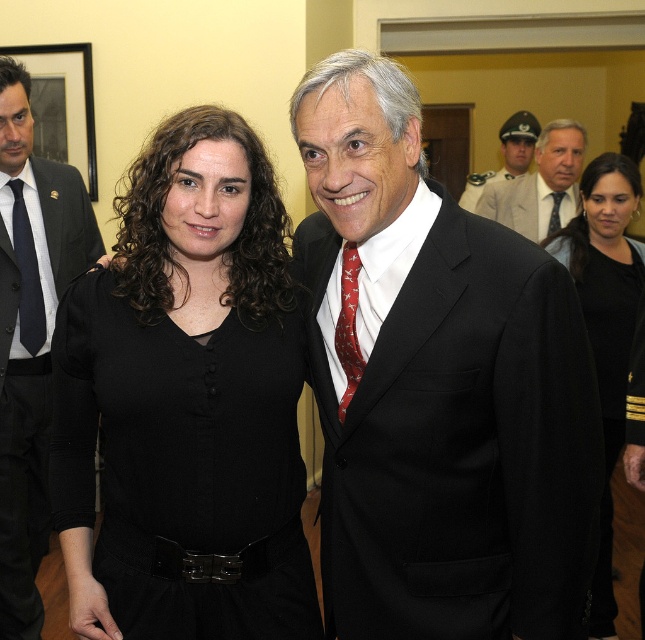
Question: Which object is the farthest from the black fabric dress at center?

Choices:
 (A) matte black tie at left
 (B) uniformed officer at center
 (C) matte black tie at center
 (D) black suit at center

Answer: (B)

Question: Which point is farther to the camera?

Choices:
 (A) uniformed officer at center
 (B) black fabric dress at center
 (C) dark gray suit at left

Answer: (A)

Question: Is black suit at center closer to camera compared to matte black tie at left?

Choices:
 (A) no
 (B) yes

Answer: (B)

Question: Does red silk tie at center have a lesser width compared to uniformed officer at center?

Choices:
 (A) no
 (B) yes

Answer: (B)

Question: Which of the following is the closest to the observer?

Choices:
 (A) black matte shirt at center
 (B) red silk tie at center
 (C) light beige uniform at center

Answer: (A)

Question: Does dark gray suit at left appear under red silk tie at center?

Choices:
 (A) yes
 (B) no

Answer: (A)